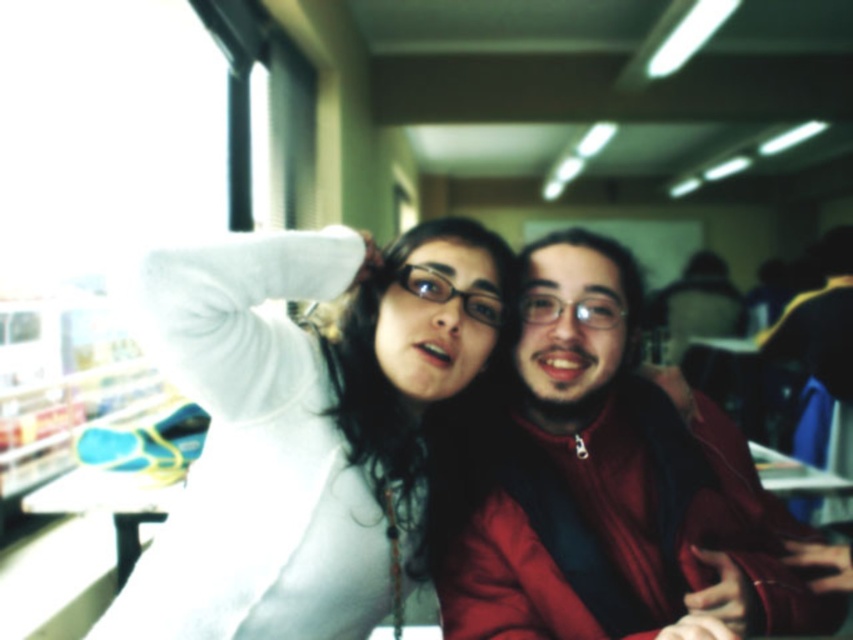
You are a photographer trying to capture a candid shot of the two people in the image. You want to ensure that both the white matte sweater at center and the matte red jacket at center are fully visible in the frame. Given their positions, which object should you focus on to ensure the narrower one is properly framed?

The white matte sweater at center has a lesser width compared to the matte red jacket at center, so you should focus on the white matte sweater at center to ensure the narrower one is properly framed.

You are a photographer trying to capture a photo of both the white matte sweater at center and the matte red jacket at center in the image. Since you want to highlight both equally, which object should you adjust your focus to prioritize in terms of size to make them appear balanced in the final shot?

The white matte sweater at center occupies less space than the matte red jacket at center. To balance their sizes in the photo, you should focus more on enlarging the white matte sweater at center or reducing the size of the matte red jacket at center in the composition.